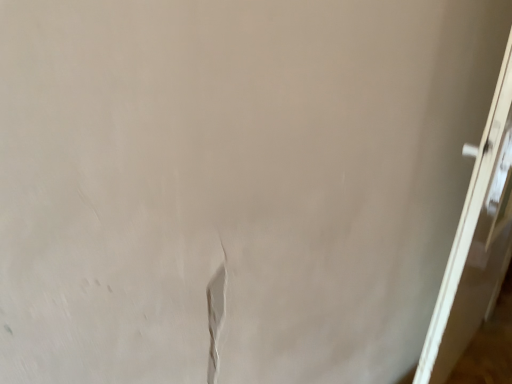
This screenshot has width=512, height=384. Find the location of `white wood screen door at right`. white wood screen door at right is located at coordinates (476, 241).

Measure the distance between point (433, 353) and camera.

A distance of 4.57 feet exists between point (433, 353) and camera.

Describe the element at coordinates (476, 241) in the screenshot. The height and width of the screenshot is (384, 512). I see `white wood screen door at right` at that location.

What are the coordinates of `white wood screen door at right` in the screenshot? It's located at (476, 241).